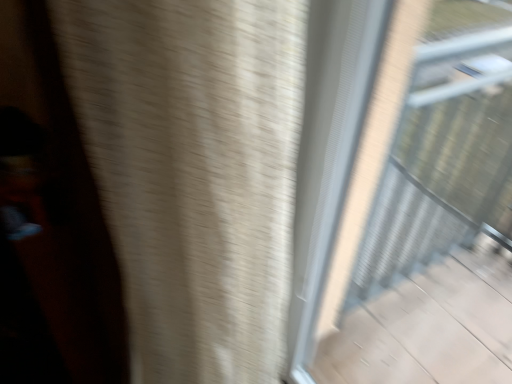
Question: Should I look upward or downward to see transparent glass window at upper right?

Choices:
 (A) up
 (B) down

Answer: (B)